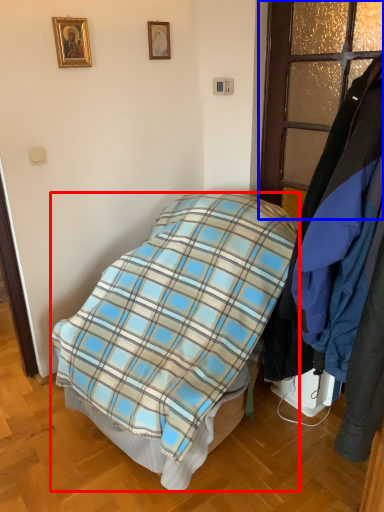
Question: Which object appears farthest to the camera in this image, bed (highlighted by a red box) or glass door (highlighted by a blue box)?

Choices:
 (A) bed
 (B) glass door

Answer: (B)